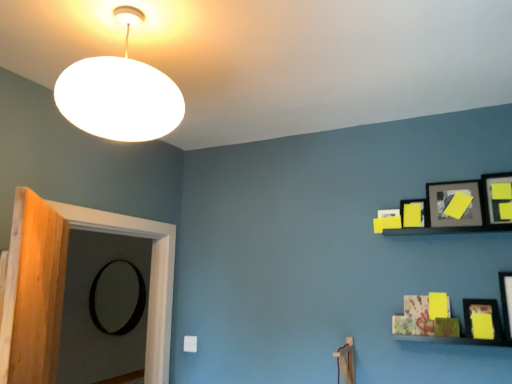
Describe the element at coordinates (414, 213) in the screenshot. This screenshot has width=512, height=384. I see `matte black picture frame at upper right, placed as the third picture frame when sorted from top to bottom` at that location.

At what (x,y) coordinates should I click in order to perform the action: click on yellow matte picture frame at upper right, acting as the second picture frame starting from the top. Please return your answer as a coordinate pair (x, y). Looking at the image, I should click on (449, 201).

In order to click on yellow matte picture frame at lower right, which is the 2th picture frame in front-to-back order in this screenshot , I will do `click(482, 312)`.

The width and height of the screenshot is (512, 384). I want to click on matte black picture frame at right, which is the sixth picture frame in back-to-front order, so click(x=506, y=301).

The height and width of the screenshot is (384, 512). Find the location of `white matte lampshade at upper left`. white matte lampshade at upper left is located at coordinates (120, 94).

Describe the element at coordinates (135, 306) in the screenshot. The height and width of the screenshot is (384, 512). I see `black matte picture frame at left, placed as the sixth picture frame when sorted from front to back` at that location.

Locate an element on the screen. The width and height of the screenshot is (512, 384). matte black picture frame at upper right, the second picture frame from the back is located at coordinates (414, 213).

Can you confirm if matte black picture frame at upper right, the second picture frame from the back, is positioned to the left of yellow matte picture frame at lower right, which is counted as the 5th picture frame, starting from the top?

Indeed, matte black picture frame at upper right, the second picture frame from the back, is positioned on the left side of yellow matte picture frame at lower right, which is counted as the 5th picture frame, starting from the top.

What's the angular difference between matte black picture frame at upper right, the second picture frame from the back, and yellow matte picture frame at lower right, which is the 2th picture frame in front-to-back order,'s facing directions?

The angular difference between matte black picture frame at upper right, the second picture frame from the back, and yellow matte picture frame at lower right, which is the 2th picture frame in front-to-back order, is 5.03 degrees.

In the scene shown: From the image's perspective, which object appears higher, matte black picture frame at upper right, the second picture frame from the back, or yellow matte picture frame at lower right, the 5th picture frame when ordered from back to front?

matte black picture frame at upper right, the second picture frame from the back, from the image's perspective.

Which of these two, matte black picture frame at upper right, which is the 4th picture frame in bottom-to-top order, or yellow matte picture frame at lower right, the 5th picture frame when ordered from back to front, is wider?

yellow matte picture frame at lower right, the 5th picture frame when ordered from back to front.

From the image's perspective, does yellow matte picture frame at upper right, acting as the second picture frame starting from the top, appear lower than black matte picture frame at left, marked as the 1th picture frame in a left-to-right arrangement?

Incorrect, from the image's perspective, yellow matte picture frame at upper right, acting as the second picture frame starting from the top, is higher than black matte picture frame at left, marked as the 1th picture frame in a left-to-right arrangement.

The width and height of the screenshot is (512, 384). Identify the location of the 4th picture frame above the black matte picture frame at left, which ranks as the first picture frame in back-to-front order (from the image's perspective). (449, 201).

Considering the sizes of yellow matte picture frame at upper right, the 4th picture frame when ordered from front to back, and black matte picture frame at left, which is the sixth picture frame in right-to-left order, in the image, is yellow matte picture frame at upper right, the 4th picture frame when ordered from front to back, taller or shorter than black matte picture frame at left, which is the sixth picture frame in right-to-left order,?

In the image, yellow matte picture frame at upper right, the 4th picture frame when ordered from front to back, appears to be shorter than black matte picture frame at left, which is the sixth picture frame in right-to-left order.

Is yellow matte picture frame at upper right, acting as the second picture frame starting from the top, not inside black matte picture frame at left, which is the sixth picture frame in right-to-left order?

yellow matte picture frame at upper right, acting as the second picture frame starting from the top, lies outside black matte picture frame at left, which is the sixth picture frame in right-to-left order,'s area.

From a real-world perspective, is black matte picture frame at left, the 6th picture frame viewed from the top, physically located above or below wooden door at left?

Clearly, from a real-world perspective, black matte picture frame at left, the 6th picture frame viewed from the top, is below wooden door at left.

Can you confirm if black matte picture frame at left, which is the sixth picture frame in right-to-left order, is shorter than wooden door at left?

Correct, black matte picture frame at left, which is the sixth picture frame in right-to-left order, is not as tall as wooden door at left.

Which object is positioned more to the left, black matte picture frame at left, which is the sixth picture frame in right-to-left order, or wooden door at left?

Positioned to the left is black matte picture frame at left, which is the sixth picture frame in right-to-left order.

Is black matte picture frame at left, the 6th picture frame viewed from the top, oriented away from wooden door at left?

No, wooden door at left is not at the back of black matte picture frame at left, the 6th picture frame viewed from the top.

Which is nearer, (x=421, y=213) or (x=82, y=62)?

The point (x=82, y=62) is in front.

From a real-world perspective, is matte black picture frame at upper right, placed as the third picture frame when sorted from top to bottom, under white matte lampshade at upper left?

Yes, from a real-world perspective, matte black picture frame at upper right, placed as the third picture frame when sorted from top to bottom, is below white matte lampshade at upper left.

Based on their sizes in the image, would you say matte black picture frame at upper right, which ranks as the 5th picture frame in right-to-left order, is bigger or smaller than white matte lampshade at upper left?

Considering their sizes, matte black picture frame at upper right, which ranks as the 5th picture frame in right-to-left order, takes up less space than white matte lampshade at upper left.

Is matte black picture frame at upper right, which is the 4th picture frame in bottom-to-top order, far from white matte lampshade at upper left?

That's right, there is a large distance between matte black picture frame at upper right, which is the 4th picture frame in bottom-to-top order, and white matte lampshade at upper left.

Are matte black picture frame at right, positioned as the sixth picture frame in left-to-right order, and matte black picture frame at upper right, which ranks as the 5th picture frame in right-to-left order, making contact?

matte black picture frame at right, positioned as the sixth picture frame in left-to-right order, and matte black picture frame at upper right, which ranks as the 5th picture frame in right-to-left order, are not in contact.

From a real-world perspective, does matte black picture frame at right, which is the sixth picture frame in back-to-front order, sit lower than matte black picture frame at upper right, which is the 4th picture frame in bottom-to-top order?

Yes, from a real-world perspective, matte black picture frame at right, which is the sixth picture frame in back-to-front order, is beneath matte black picture frame at upper right, which is the 4th picture frame in bottom-to-top order.

Which is behind, point (507, 297) or point (419, 217)?

The point (419, 217) is behind.

Is matte black picture frame at right, which is counted as the 4th picture frame, starting from the top, behind wooden door at left?

No, matte black picture frame at right, which is counted as the 4th picture frame, starting from the top, is closer to the viewer.

Which object is positioned more to the left, matte black picture frame at right, positioned as the 1th picture frame in right-to-left order, or wooden door at left?

From the viewer's perspective, wooden door at left appears more on the left side.

Considering the positions of point (508, 317) and point (79, 303), is point (508, 317) closer or farther from the camera than point (79, 303)?

Point (508, 317).

Where is `door located behind the matte black picture frame at right, positioned as the 1th picture frame in right-to-left order`? The height and width of the screenshot is (384, 512). door located behind the matte black picture frame at right, positioned as the 1th picture frame in right-to-left order is located at coordinates (103, 307).

Based on their sizes in the image, would you say black matte picture frame at left, which is the sixth picture frame in right-to-left order, is bigger or smaller than matte black picture frame at upper right, the second picture frame from the back?

In the image, black matte picture frame at left, which is the sixth picture frame in right-to-left order, appears to be larger than matte black picture frame at upper right, the second picture frame from the back.

Is black matte picture frame at left, marked as the 1th picture frame in a left-to-right arrangement, situated inside matte black picture frame at upper right, which ranks as the 5th picture frame in right-to-left order, or outside?

black matte picture frame at left, marked as the 1th picture frame in a left-to-right arrangement, cannot be found inside matte black picture frame at upper right, which ranks as the 5th picture frame in right-to-left order.

Looking at this image, between black matte picture frame at left, the 6th picture frame viewed from the top, and matte black picture frame at upper right, the 5th picture frame in the front-to-back sequence, which one has smaller width?

matte black picture frame at upper right, the 5th picture frame in the front-to-back sequence.

From a real-world perspective, is black matte picture frame at left, which ranks as the 1th picture frame in bottom-to-top order, positioned over matte black picture frame at upper right, placed as the third picture frame when sorted from top to bottom, based on gravity?

Incorrect, from a real-world perspective, black matte picture frame at left, which ranks as the 1th picture frame in bottom-to-top order, is lower than matte black picture frame at upper right, placed as the third picture frame when sorted from top to bottom.

Starting from the matte black picture frame at upper right, which ranks as the 5th picture frame in right-to-left order, which picture frame is the 2nd one to the right? Please provide its 2D coordinates.

[(482, 312)]

You are a GUI agent. You are given a task and a screenshot of the screen. Output one action in this format:
    pyautogui.click(x=<x>, y=<y>)
    Task: Click on the 2nd picture frame counting from the left of the yellow matte picture frame at upper right, the third picture frame positioned from the back
    The width and height of the screenshot is (512, 384).
    Given the screenshot: What is the action you would take?
    pyautogui.click(x=135, y=306)

Which object lies nearer to the anchor point yellow matte picture frame at upper right, which ranks as the 5th picture frame in bottom-to-top order, yellow matte picture frame at upper right, the 1th picture frame when ordered from top to bottom, or black matte picture frame at left, marked as the 1th picture frame in a left-to-right arrangement?

yellow matte picture frame at upper right, the 1th picture frame when ordered from top to bottom, lies closer to yellow matte picture frame at upper right, which ranks as the 5th picture frame in bottom-to-top order, than the other object.

Estimate the real-world distances between objects in this image. Which object is closer to wooden door at left, yellow matte picture frame at upper right, the 1th picture frame when ordered from top to bottom, or yellow matte picture frame at lower right, the second picture frame when ordered from bottom to top?

Based on the image, yellow matte picture frame at lower right, the second picture frame when ordered from bottom to top, appears to be nearer to wooden door at left.

Which object lies nearer to the anchor point black matte picture frame at left, the 6th picture frame viewed from the top, yellow matte picture frame at upper right, the third picture frame positioned from the back, or matte black picture frame at right, which is the sixth picture frame in back-to-front order?

Among the two, yellow matte picture frame at upper right, the third picture frame positioned from the back, is located nearer to black matte picture frame at left, the 6th picture frame viewed from the top.

Estimate the real-world distances between objects in this image. Which object is further from matte black picture frame at right, positioned as the sixth picture frame in left-to-right order, yellow matte picture frame at upper right, which ranks as the 5th picture frame in bottom-to-top order, or black matte picture frame at left, which ranks as the first picture frame in back-to-front order?

black matte picture frame at left, which ranks as the first picture frame in back-to-front order, is further to matte black picture frame at right, positioned as the sixth picture frame in left-to-right order.

Which object lies further to the anchor point yellow matte picture frame at upper right, which ranks as the 5th picture frame in bottom-to-top order, yellow matte picture frame at lower right, the second picture frame when ordered from bottom to top, or matte black picture frame at right, the third picture frame ordered from the bottom?

The object further to yellow matte picture frame at upper right, which ranks as the 5th picture frame in bottom-to-top order, is yellow matte picture frame at lower right, the second picture frame when ordered from bottom to top.

Looking at this image, considering their positions, is yellow matte picture frame at lower right, which is counted as the 5th picture frame, starting from the top, positioned further to yellow matte picture frame at upper right, which ranks as the 5th picture frame in bottom-to-top order, than white matte lampshade at upper left?

white matte lampshade at upper left is further to yellow matte picture frame at upper right, which ranks as the 5th picture frame in bottom-to-top order.

Considering their positions, is matte black picture frame at upper right, the 2th picture frame positioned from the left, positioned further to yellow matte picture frame at upper right, acting as the second picture frame starting from the top, than yellow matte picture frame at upper right, which is the fifth picture frame from left to right?

matte black picture frame at upper right, the 2th picture frame positioned from the left, is further to yellow matte picture frame at upper right, acting as the second picture frame starting from the top.

Based on their spatial positions, is white matte lampshade at upper left or matte black picture frame at right, which is counted as the 4th picture frame, starting from the top, closer to yellow matte picture frame at upper right, acting as the 4th picture frame starting from the back?

Among the two, matte black picture frame at right, which is counted as the 4th picture frame, starting from the top, is located nearer to yellow matte picture frame at upper right, acting as the 4th picture frame starting from the back.

Where is `lamp between wooden door at left and matte black picture frame at right, the third picture frame ordered from the bottom, from left to right`? This screenshot has height=384, width=512. lamp between wooden door at left and matte black picture frame at right, the third picture frame ordered from the bottom, from left to right is located at coordinates (120, 94).

This screenshot has width=512, height=384. I want to click on picture frame between wooden door at left and yellow matte picture frame at upper right, the fourth picture frame positioned from the right, from left to right, so click(x=414, y=213).

This screenshot has height=384, width=512. I want to click on lamp situated between wooden door at left and yellow matte picture frame at lower right, which is the 2th picture frame in front-to-back order, from left to right, so click(120, 94).

Image resolution: width=512 pixels, height=384 pixels. What are the coordinates of `picture frame between yellow matte picture frame at upper right, which ranks as the 5th picture frame in bottom-to-top order, and black matte picture frame at left, marked as the 1th picture frame in a left-to-right arrangement, in the front-back direction` in the screenshot? It's located at (414, 213).